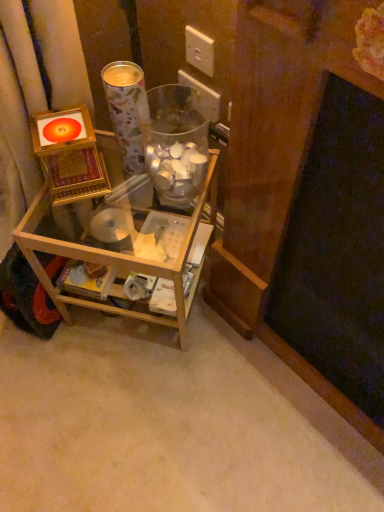
Question: Is white plastic electric outlet at upper center, acting as the 1th electric outlet starting from the back, outside of transparent glass jar at center?

Choices:
 (A) no
 (B) yes

Answer: (B)

Question: Is white plastic electric outlet at upper center, acting as the 1th electric outlet starting from the back, facing away from transparent glass jar at center?

Choices:
 (A) no
 (B) yes

Answer: (A)

Question: Is white plastic electric outlet at upper center, the second electric outlet when ordered from front to back, not near transparent glass jar at center?

Choices:
 (A) no
 (B) yes

Answer: (A)

Question: From a real-world perspective, is white plastic electric outlet at upper center, the second electric outlet when ordered from front to back, on transparent glass jar at center?

Choices:
 (A) no
 (B) yes

Answer: (A)

Question: Is white plastic electric outlet at upper center, the second electric outlet when ordered from front to back, smaller than transparent glass jar at center?

Choices:
 (A) yes
 (B) no

Answer: (A)

Question: Does white plastic electric outlet at upper center, acting as the 1th electric outlet starting from the back, have a larger size compared to transparent glass jar at center?

Choices:
 (A) no
 (B) yes

Answer: (A)

Question: Is metallic paper cup at upper center aimed at white plastic electric outlet at upper center, marked as the first electric outlet in a front-to-back arrangement?

Choices:
 (A) no
 (B) yes

Answer: (A)

Question: Is metallic paper cup at upper center smaller than white plastic electric outlet at upper center, which ranks as the second electric outlet in back-to-front order?

Choices:
 (A) no
 (B) yes

Answer: (A)

Question: Is metallic paper cup at upper center to the left of white plastic electric outlet at upper center, marked as the first electric outlet in a front-to-back arrangement, from the viewer's perspective?

Choices:
 (A) yes
 (B) no

Answer: (A)

Question: Does metallic paper cup at upper center have a greater height compared to white plastic electric outlet at upper center, which ranks as the second electric outlet in back-to-front order?

Choices:
 (A) no
 (B) yes

Answer: (B)

Question: Is metallic paper cup at upper center positioned far away from white plastic electric outlet at upper center, marked as the first electric outlet in a front-to-back arrangement?

Choices:
 (A) yes
 (B) no

Answer: (B)

Question: From a real-world perspective, is metallic paper cup at upper center positioned over white plastic electric outlet at upper center, marked as the first electric outlet in a front-to-back arrangement, based on gravity?

Choices:
 (A) no
 (B) yes

Answer: (A)

Question: Is metallic paper cup at upper center at the right side of white plastic electric outlet at upper center, acting as the 1th electric outlet starting from the back?

Choices:
 (A) no
 (B) yes

Answer: (A)